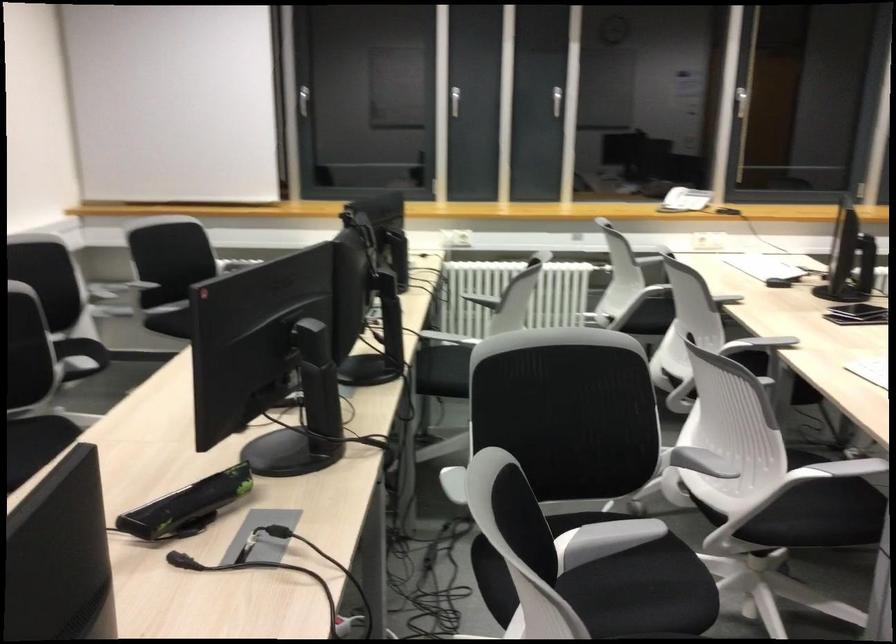
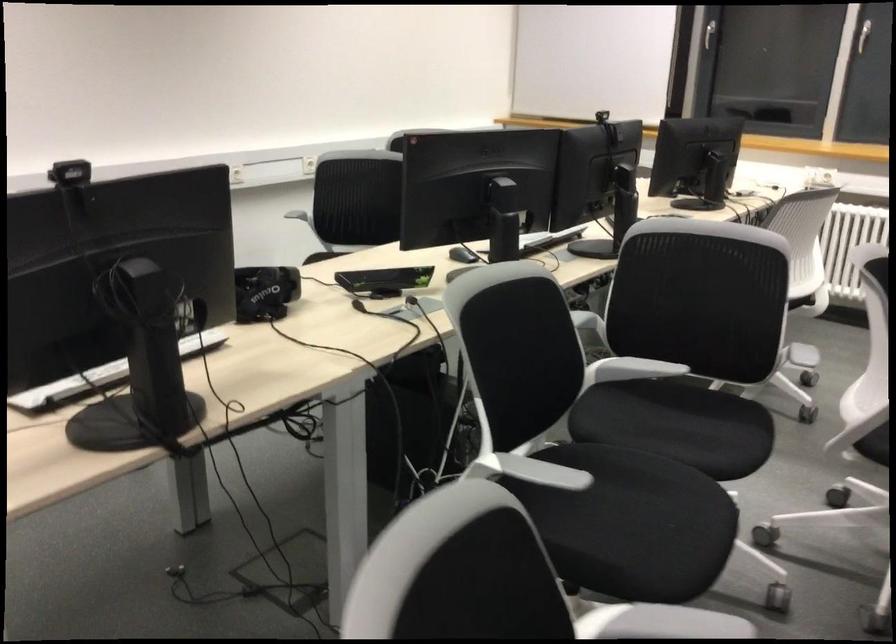
Find the pixel in the second image that matches point 727,466 in the first image.

(803, 355)